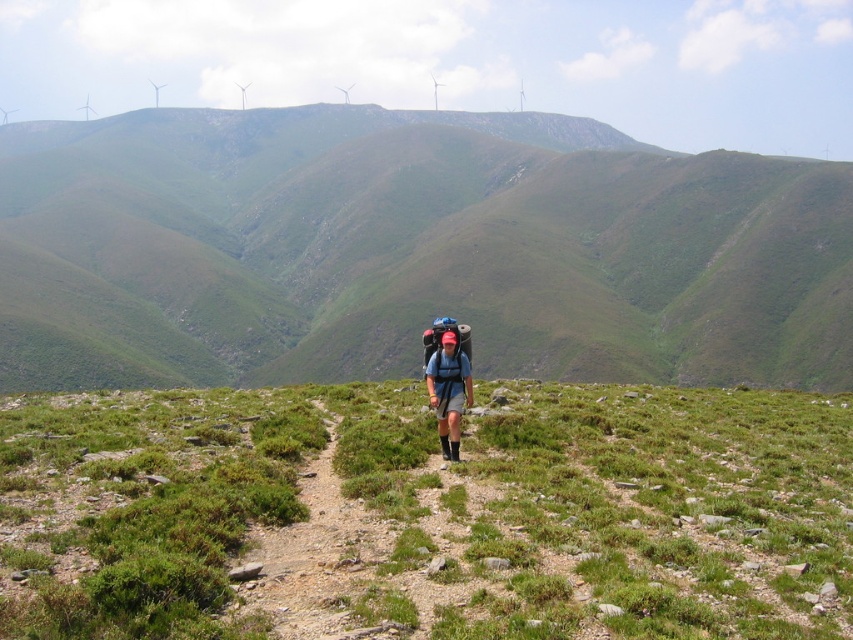
Question: Does green grassy hill at center lie behind green grassy at center?

Choices:
 (A) yes
 (B) no

Answer: (A)

Question: Which point is farther to the camera?

Choices:
 (A) dirt/gravel path at center
 (B) green grassy at center

Answer: (A)

Question: Among these objects, which one is nearest to the camera?

Choices:
 (A) matte blue backpack at center
 (B) green grassy hill at center
 (C) dirt/gravel path at center
 (D) green grassy at center

Answer: (D)

Question: Can you confirm if green grassy at center is thinner than matte blue backpack at center?

Choices:
 (A) yes
 (B) no

Answer: (B)

Question: Is green grassy hill at center positioned in front of green grassy at center?

Choices:
 (A) no
 (B) yes

Answer: (A)

Question: Among these objects, which one is nearest to the camera?

Choices:
 (A) green grassy hill at center
 (B) matte blue backpack at center
 (C) dirt/gravel path at center

Answer: (C)